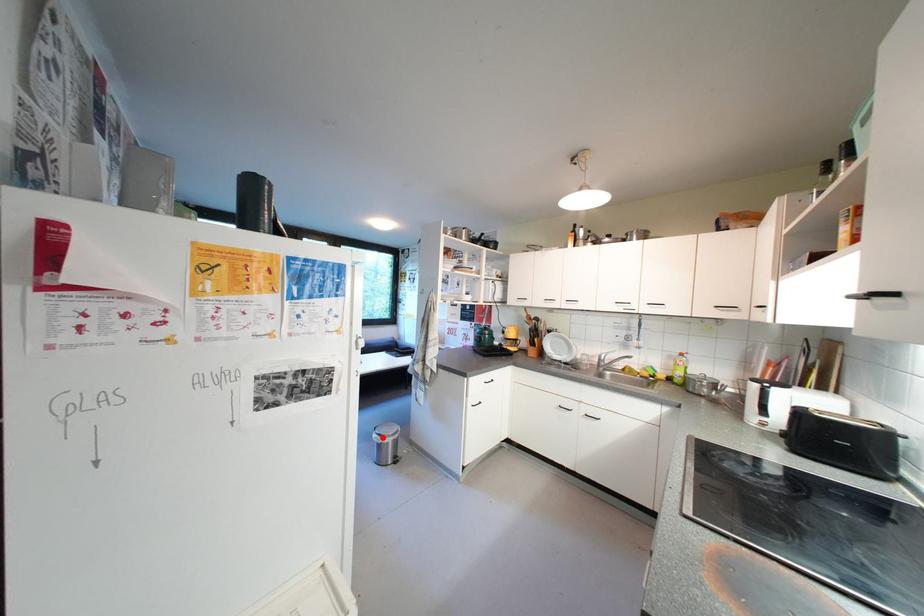
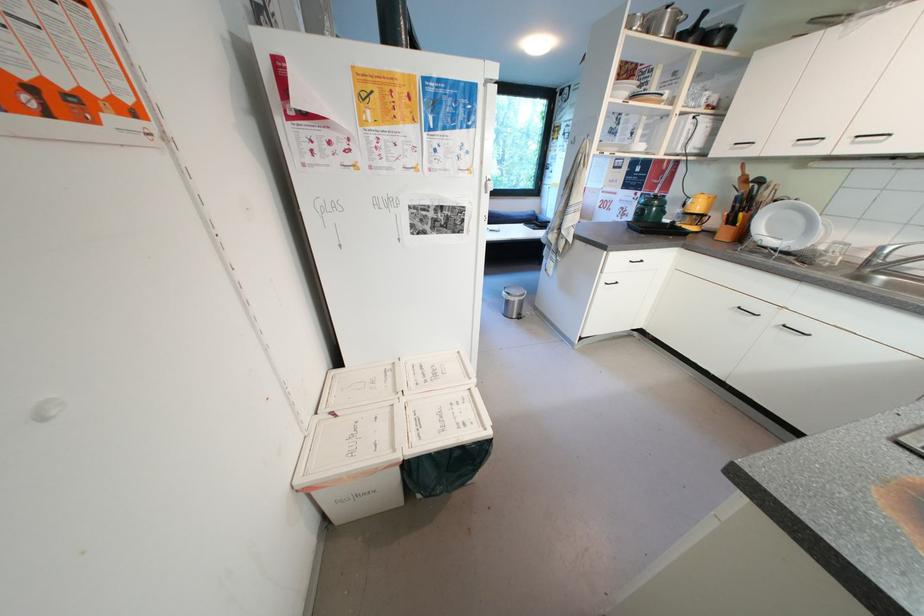
Locate, in the second image, the point that corresponds to the highlighted location in the first image.

(512, 294)